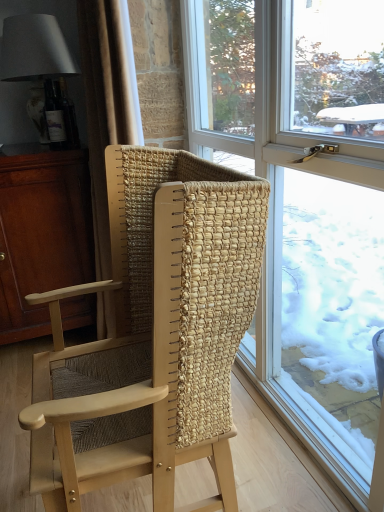
Question: Can you confirm if matte white lampshade at upper left is smaller than matte brown cabinet at left?

Choices:
 (A) no
 (B) yes

Answer: (B)

Question: Can you confirm if matte white lampshade at upper left is shorter than matte brown cabinet at left?

Choices:
 (A) no
 (B) yes

Answer: (B)

Question: Is the depth of matte white lampshade at upper left greater than that of matte brown cabinet at left?

Choices:
 (A) no
 (B) yes

Answer: (B)

Question: From the image's perspective, is matte white lampshade at upper left beneath matte brown cabinet at left?

Choices:
 (A) no
 (B) yes

Answer: (A)

Question: Would you say matte white lampshade at upper left is a long distance from matte brown cabinet at left?

Choices:
 (A) no
 (B) yes

Answer: (A)

Question: Is the position of matte white lampshade at upper left less distant than that of matte brown cabinet at left?

Choices:
 (A) yes
 (B) no

Answer: (B)

Question: Is clear glass window at center next to natural woven wood chair at center and touching it?

Choices:
 (A) yes
 (B) no

Answer: (B)

Question: From a real-world perspective, is clear glass window at center under natural woven wood chair at center?

Choices:
 (A) yes
 (B) no

Answer: (B)

Question: Can you confirm if clear glass window at center is bigger than natural woven wood chair at center?

Choices:
 (A) no
 (B) yes

Answer: (A)

Question: From a real-world perspective, is clear glass window at center on natural woven wood chair at center?

Choices:
 (A) yes
 (B) no

Answer: (A)

Question: Is clear glass window at center not inside natural woven wood chair at center?

Choices:
 (A) yes
 (B) no

Answer: (A)

Question: Can you confirm if clear glass window at center is taller than natural woven wood chair at center?

Choices:
 (A) yes
 (B) no

Answer: (A)

Question: Are matte brown cabinet at left and beige woven curtain at left far apart?

Choices:
 (A) no
 (B) yes

Answer: (A)